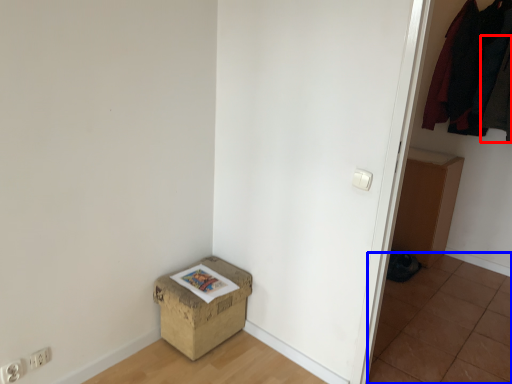
Question: Which point is closer to the camera, clothing (highlighted by a red box) or tile (highlighted by a blue box)?

Choices:
 (A) clothing
 (B) tile

Answer: (B)